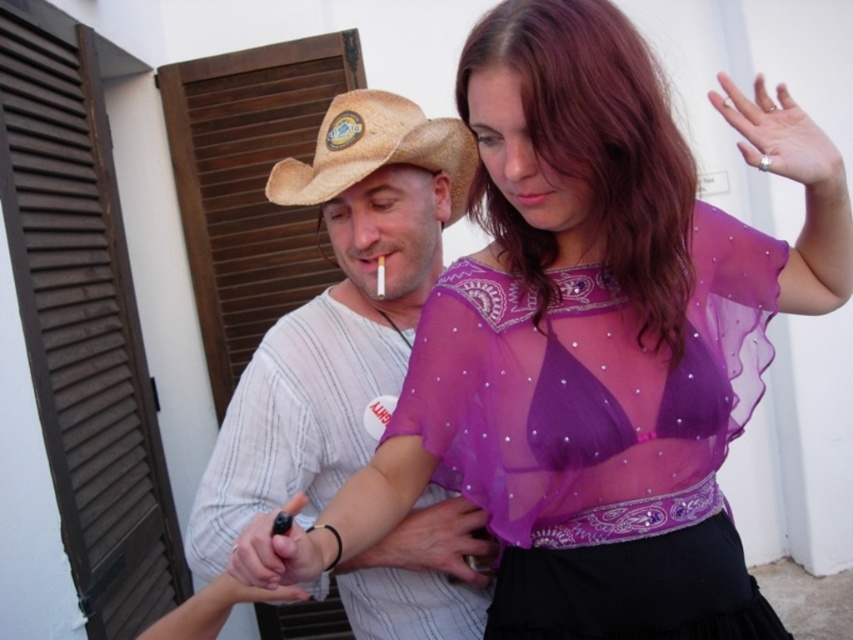
You are standing 1.5 meters tall. You want to reach the point at coordinates point (223, 488). Can you reach it without jumping?

The point (223, 488) is 1.31 meters away from you. Since you are 1.5 meters tall, you can reach it without jumping.

Based on the photo, you are standing in front of a painting that depicts two people in an outdoor setting. The painting includes a sheer purple fabric dress at center and a straw hat at center. Which object is positioned closer to you in the painting?

The sheer purple fabric dress at center is closer to the viewer than the straw hat at center.